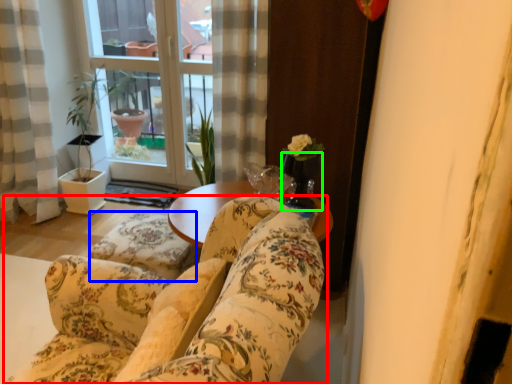
Question: Based on their relative distances, which object is farther from studio couch (highlighted by a red box)? Choose from flat (highlighted by a blue box) and glass vase (highlighted by a green box).

Choices:
 (A) flat
 (B) glass vase

Answer: (B)